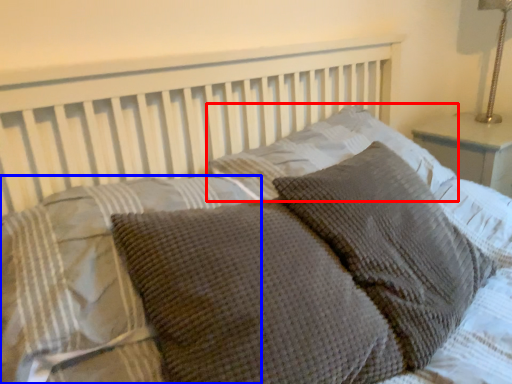
Question: Which object appears farthest to the camera in this image, pillow (highlighted by a red box) or pillow (highlighted by a blue box)?

Choices:
 (A) pillow
 (B) pillow

Answer: (A)